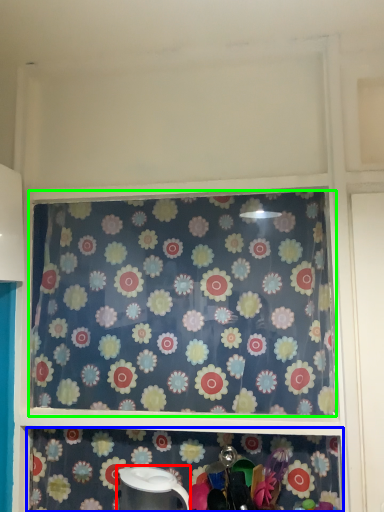
Question: Based on their relative distances, which object is farther from appliance (highlighted by a red box)? Choose from shelf (highlighted by a blue box) and curtain (highlighted by a green box).

Choices:
 (A) shelf
 (B) curtain

Answer: (B)